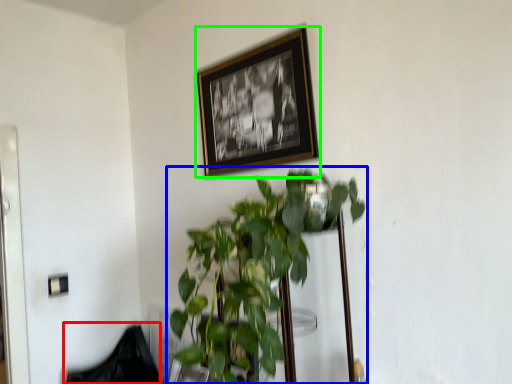
Question: Based on their relative distances, which object is farther from swivel chair (highlighted by a red box)? Choose from houseplant (highlighted by a blue box) and picture frame (highlighted by a green box).

Choices:
 (A) houseplant
 (B) picture frame

Answer: (B)